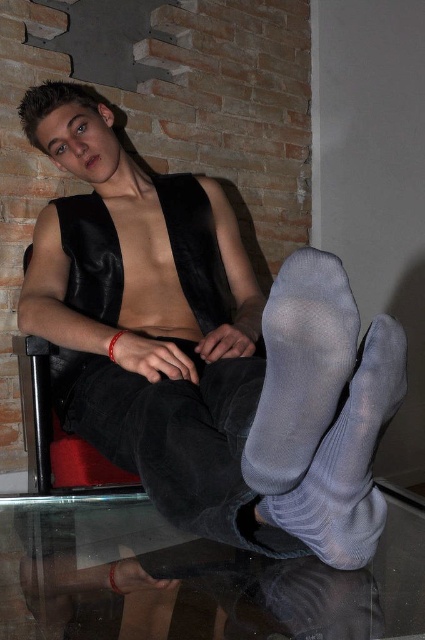
Question: Which object is the farthest from the gray knitted sock at lower center?

Choices:
 (A) gray mesh socks at lower center
 (B) transparent glass table at lower center

Answer: (B)

Question: Is gray mesh socks at lower center closer to camera compared to gray knitted sock at lower center?

Choices:
 (A) no
 (B) yes

Answer: (B)

Question: Which point is farther from the camera taking this photo?

Choices:
 (A) (95, 221)
 (B) (232, 557)
 (C) (353, 545)
 (D) (311, 275)

Answer: (A)

Question: Can you confirm if satin black vest at upper center is positioned above transparent glass table at lower center?

Choices:
 (A) yes
 (B) no

Answer: (A)

Question: Which of the following is the farthest from the observer?

Choices:
 (A) (305, 316)
 (B) (104, 506)

Answer: (B)

Question: Is satin black vest at upper center below gray knitted sock at lower center?

Choices:
 (A) no
 (B) yes

Answer: (A)